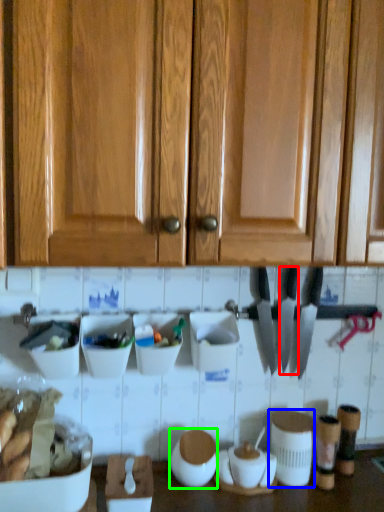
Question: Based on their relative distances, which object is nearer to knife (highlighted by a red box)? Choose from appliance (highlighted by a blue box) and appliance (highlighted by a green box).

Choices:
 (A) appliance
 (B) appliance

Answer: (A)